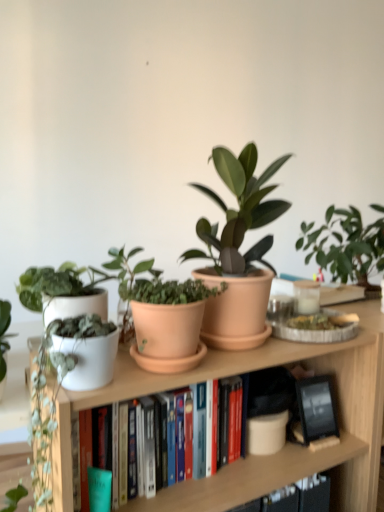
Question: Is white matte plant pot at left positioned in front of white matte book at center?

Choices:
 (A) no
 (B) yes

Answer: (B)

Question: From the image's perspective, is white matte plant pot at left below white matte book at center?

Choices:
 (A) no
 (B) yes

Answer: (B)

Question: Could you tell me if white matte plant pot at left is facing white matte book at center?

Choices:
 (A) yes
 (B) no

Answer: (A)

Question: Is white matte plant pot at left thinner than white matte book at center?

Choices:
 (A) no
 (B) yes

Answer: (A)

Question: Is white matte plant pot at left taller than white matte book at center?

Choices:
 (A) no
 (B) yes

Answer: (B)

Question: Is white matte plant pot at left not inside white matte book at center?

Choices:
 (A) yes
 (B) no

Answer: (A)

Question: Is white matte pot at left, marked as the 3th houseplant in a right-to-left arrangement, looking in the opposite direction of matte terracotta pot at center, acting as the 3th houseplant starting from the left?

Choices:
 (A) no
 (B) yes

Answer: (A)

Question: Is white matte pot at left, which is the first houseplant from left to right, not close to matte terracotta pot at center, acting as the 3th houseplant starting from the left?

Choices:
 (A) yes
 (B) no

Answer: (B)

Question: Can you confirm if white matte pot at left, marked as the 3th houseplant in a right-to-left arrangement, is wider than matte terracotta pot at center, the first houseplant from the right?

Choices:
 (A) yes
 (B) no

Answer: (B)

Question: Does white matte pot at left, marked as the 3th houseplant in a right-to-left arrangement, have a lesser width compared to matte terracotta pot at center, acting as the 3th houseplant starting from the left?

Choices:
 (A) yes
 (B) no

Answer: (A)

Question: Can you see white matte pot at left, which is the first houseplant from left to right, touching matte terracotta pot at center, acting as the 3th houseplant starting from the left?

Choices:
 (A) no
 (B) yes

Answer: (A)

Question: Does white matte pot at left, which is the first houseplant from left to right, turn towards matte terracotta pot at center, the first houseplant from the right?

Choices:
 (A) yes
 (B) no

Answer: (B)

Question: Considering the relative positions of white matte book at center and matte terracotta pot at center, the first houseplant from the right, in the image provided, is white matte book at center behind matte terracotta pot at center, the first houseplant from the right,?

Choices:
 (A) no
 (B) yes

Answer: (A)